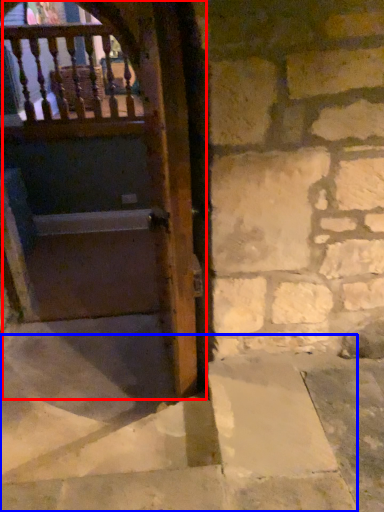
Question: Which object is closer to the camera taking this photo, door (highlighted by a red box) or stairwell (highlighted by a blue box)?

Choices:
 (A) door
 (B) stairwell

Answer: (B)